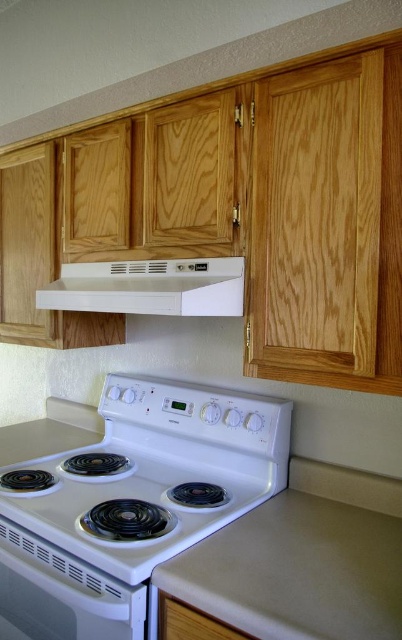
Question: Does white glossy stove at center appear on the left side of white glossy electric stove at lower left?

Choices:
 (A) yes
 (B) no

Answer: (B)

Question: Which point is closer to the camera?

Choices:
 (A) white matte exhaust hood at center
 (B) white glossy stove at center
 (C) beige laminate counter top at lower center

Answer: (C)

Question: Can you confirm if white glossy electric stove at center is smaller than beige laminate counter top at lower center?

Choices:
 (A) yes
 (B) no

Answer: (B)

Question: Does beige laminate counter top at lower center have a smaller size compared to white matte exhaust hood at center?

Choices:
 (A) yes
 (B) no

Answer: (A)

Question: Which of the following is the farthest from the observer?

Choices:
 (A) white glossy electric stove at center
 (B) beige laminate counter top at lower center

Answer: (A)

Question: Which point appears farthest from the camera in this image?

Choices:
 (A) (96, 534)
 (B) (295, 541)
 (C) (61, 285)

Answer: (C)